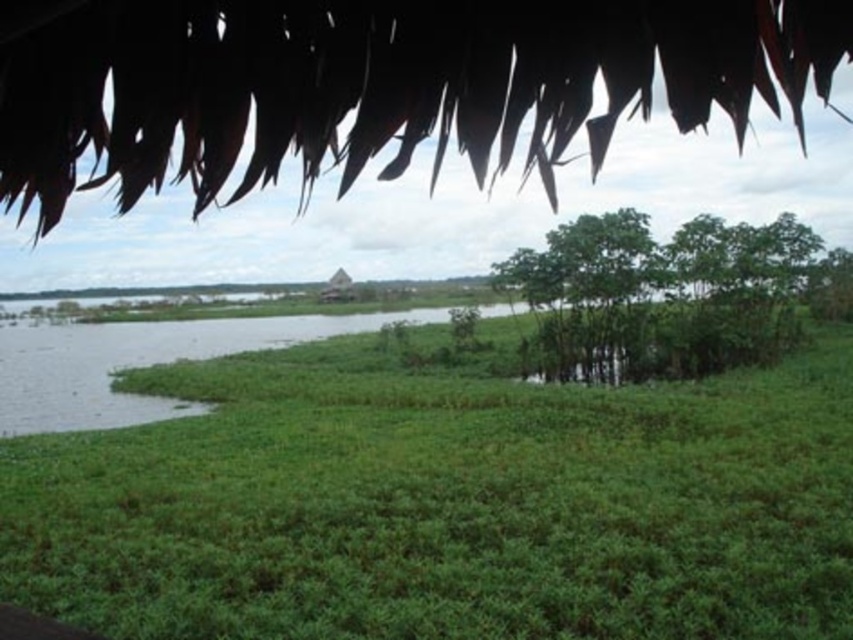
Question: Which of the following is the farthest from the observer?

Choices:
 (A) green leafy trees at center-right
 (B) green leafy tree at upper center
 (C) green leafy grass at center

Answer: (A)

Question: Which point is farther to the camera?

Choices:
 (A) green leafy grass at center
 (B) green leafy trees at center-right
 (C) green leafy tree at upper center

Answer: (B)

Question: Which point is closer to the camera taking this photo?

Choices:
 (A) (126, 444)
 (B) (221, 106)
 (C) (694, 220)

Answer: (B)

Question: Does green leafy tree at upper center come behind green leafy trees at center-right?

Choices:
 (A) no
 (B) yes

Answer: (A)

Question: Does green leafy grass at center have a larger size compared to green leafy trees at center-right?

Choices:
 (A) no
 (B) yes

Answer: (A)

Question: Where is green leafy tree at upper center located in relation to green leafy trees at center-right in the image?

Choices:
 (A) right
 (B) left

Answer: (B)